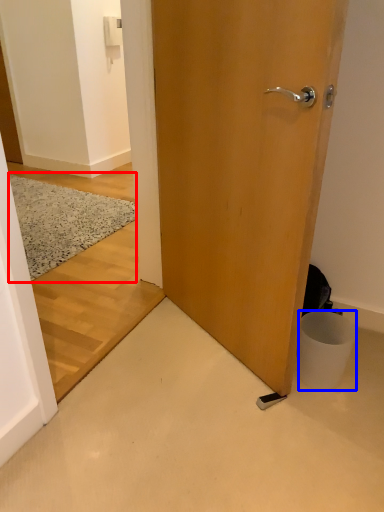
Question: Which point is further to the camera, doormat (highlighted by a red box) or trash bin/can (highlighted by a blue box)?

Choices:
 (A) doormat
 (B) trash bin/can

Answer: (A)